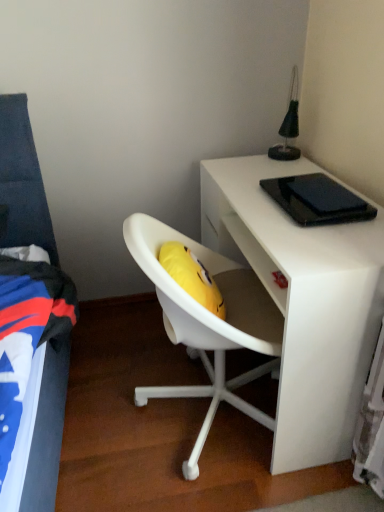
Question: Should I look upward or downward to see white matte desk at upper right?

Choices:
 (A) up
 (B) down

Answer: (B)